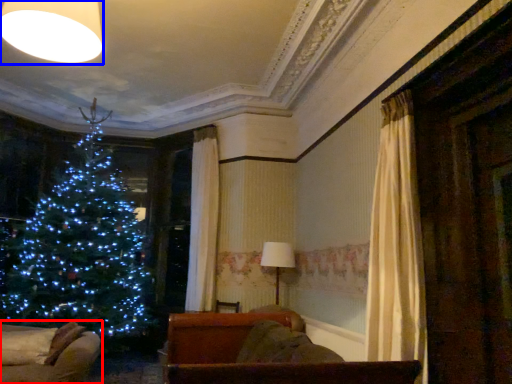
Question: Which object is further to the camera taking this photo, furniture (highlighted by a red box) or lighting (highlighted by a blue box)?

Choices:
 (A) furniture
 (B) lighting

Answer: (A)